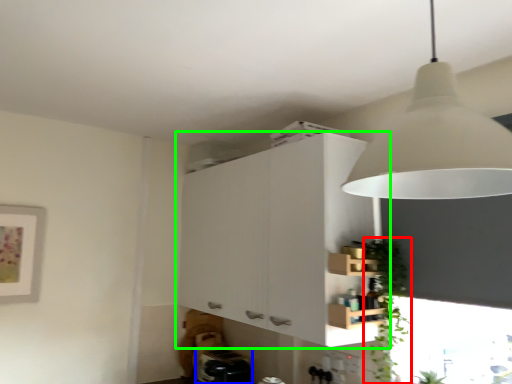
Question: Which is farther away from plant (highlighted by a red box)? appliance (highlighted by a blue box) or cabinetry (highlighted by a green box)?

Choices:
 (A) appliance
 (B) cabinetry

Answer: (A)